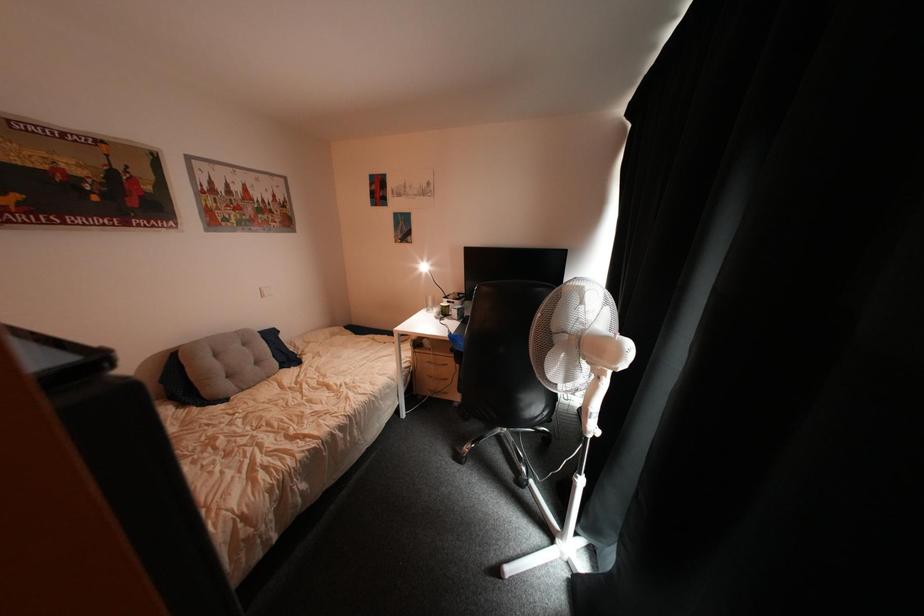
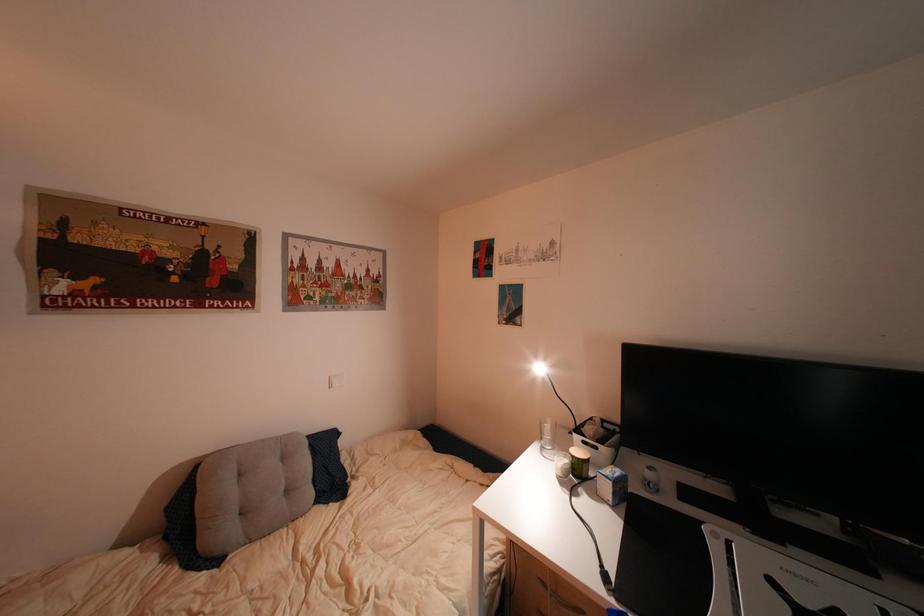
Question: The camera is either moving clockwise (left) or counter-clockwise (right) around the object. The first image is from the beginning of the video and the second image is from the end. Is the camera moving left or right when shooting the video?

Choices:
 (A) Left
 (B) Right

Answer: (B)